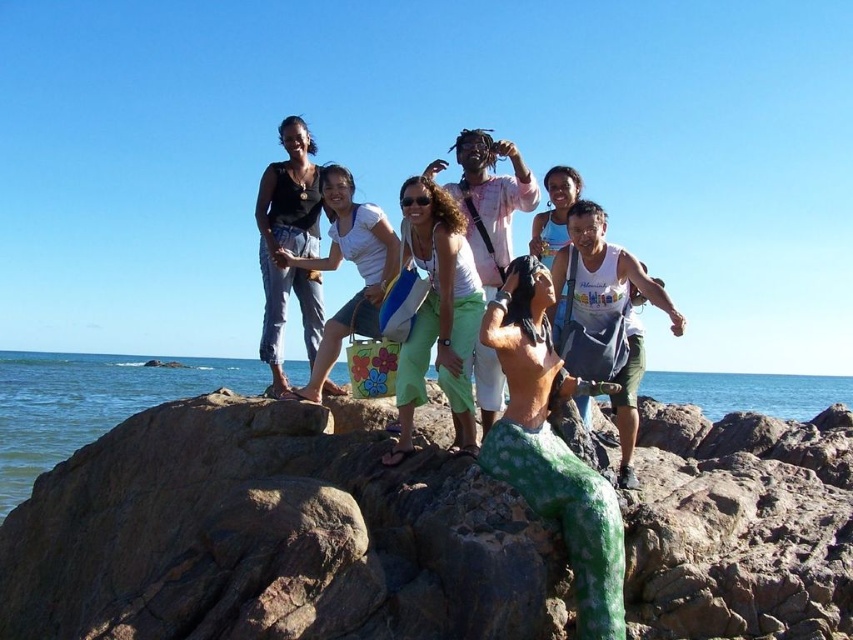
Question: Which object is farther from the camera taking this photo?

Choices:
 (A) matte black tank top at upper left
 (B) white fabric bag at center

Answer: (A)

Question: Is green painted rock at center bigger than white cotton tank top at center?

Choices:
 (A) no
 (B) yes

Answer: (B)

Question: Which point is closer to the camera taking this photo?

Choices:
 (A) (125, 384)
 (B) (285, 300)

Answer: (B)

Question: Estimate the real-world distances between objects in this image. Which object is farther from the white fabric bag at center?

Choices:
 (A) matte black tank top at upper left
 (B) green painted rock at center

Answer: (B)

Question: Can you confirm if matte black tank top at upper left is positioned below white fabric bag at center?

Choices:
 (A) no
 (B) yes

Answer: (A)

Question: Is greenish-blue water at center positioned behind matte black tank top at upper left?

Choices:
 (A) no
 (B) yes

Answer: (A)